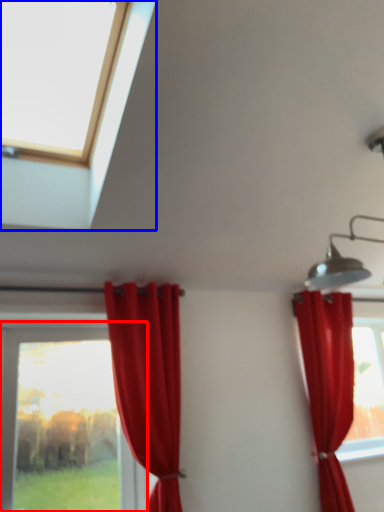
Question: Among these objects, which one is nearest to the camera, window (highlighted by a red box) or window (highlighted by a blue box)?

Choices:
 (A) window
 (B) window

Answer: (B)